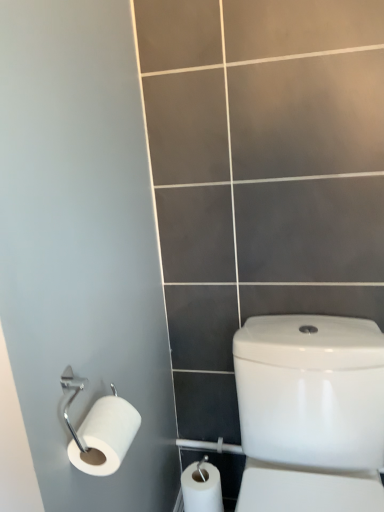
Question: From the image's perspective, is white glossy water tank at right under white matte toilet paper at left?

Choices:
 (A) yes
 (B) no

Answer: (A)

Question: Does white glossy water tank at right have a lesser height compared to white matte toilet paper at left?

Choices:
 (A) yes
 (B) no

Answer: (B)

Question: Is white glossy water tank at right further to camera compared to white matte toilet paper at left?

Choices:
 (A) yes
 (B) no

Answer: (B)

Question: Is the position of white glossy water tank at right less distant than that of white matte toilet paper at left?

Choices:
 (A) yes
 (B) no

Answer: (A)

Question: From the image's perspective, is white glossy water tank at right located above white matte toilet paper at left?

Choices:
 (A) yes
 (B) no

Answer: (B)

Question: Is white matte toilet paper at left completely or partially inside white glossy water tank at right?

Choices:
 (A) yes
 (B) no

Answer: (B)

Question: Is white matte toilet paper at left surrounding white glossy water tank at right?

Choices:
 (A) yes
 (B) no

Answer: (B)

Question: Considering the relative positions of white matte toilet paper at left and white glossy water tank at right in the image provided, is white matte toilet paper at left in front of white glossy water tank at right?

Choices:
 (A) no
 (B) yes

Answer: (A)

Question: Does white matte toilet paper at left lie behind white glossy water tank at right?

Choices:
 (A) no
 (B) yes

Answer: (B)

Question: Considering the relative positions of white matte toilet paper at left and white glossy water tank at right in the image provided, is white matte toilet paper at left to the right of white glossy water tank at right from the viewer's perspective?

Choices:
 (A) no
 (B) yes

Answer: (A)

Question: Is white matte toilet paper at left wider than white glossy water tank at right?

Choices:
 (A) yes
 (B) no

Answer: (B)

Question: Considering the relative sizes of white matte toilet paper at left and white glossy water tank at right in the image provided, is white matte toilet paper at left bigger than white glossy water tank at right?

Choices:
 (A) yes
 (B) no

Answer: (B)

Question: Is white glossy water tank at right bigger or smaller than white matte toilet paper at left?

Choices:
 (A) big
 (B) small

Answer: (A)